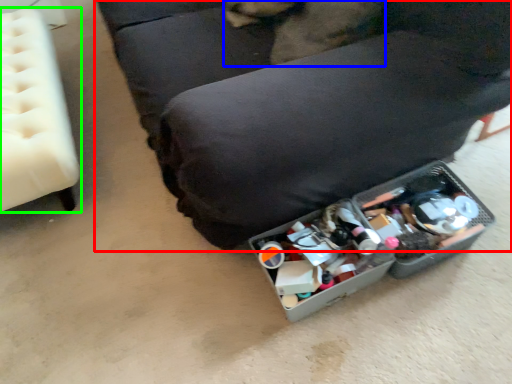
Question: Based on their relative distances, which object is farther from furniture (highlighted by a red box)? Choose from animal (highlighted by a blue box) and furniture (highlighted by a green box).

Choices:
 (A) animal
 (B) furniture

Answer: (B)